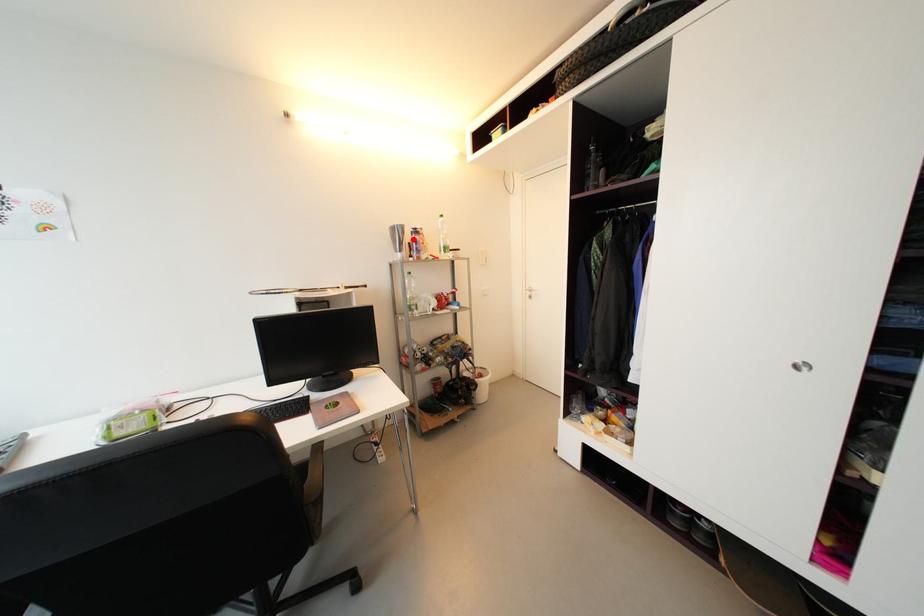
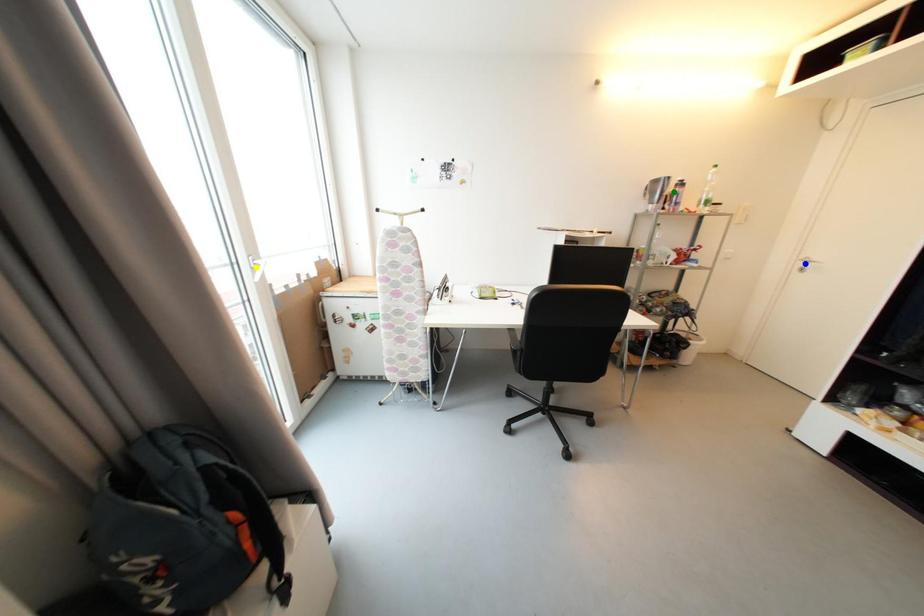
Question: I am providing you with two images of the same scene from different viewpoints. A red point is marked on the first image. You are given multiple points on the second image. Can you choose the point in image 2 that corresponds to the point in image 1?

Choices:
 (A) yellow point
 (B) green point
 (C) blue point

Answer: (B)